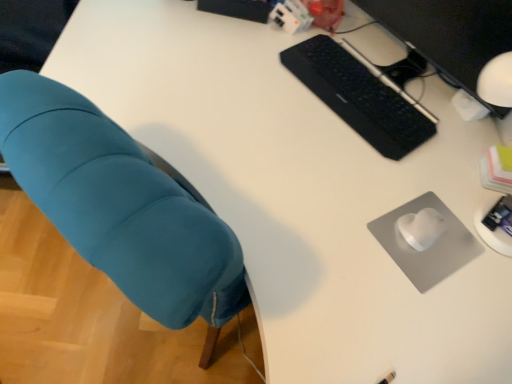
Identify the location of free area below gray matte mousepad at lower right (from a real-world perspective). This screenshot has height=384, width=512. (432, 258).